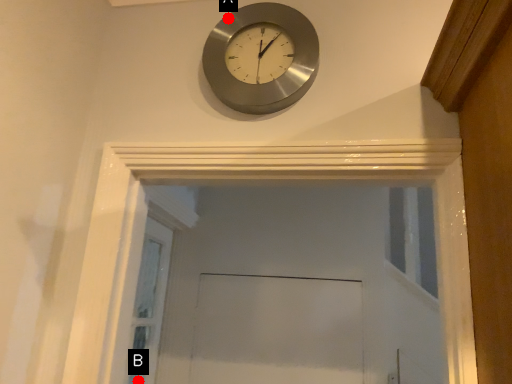
Question: Two points are circled on the image, labeled by A and B beside each circle. Which point is closer to the camera taking this photo?

Choices:
 (A) A is closer
 (B) B is closer

Answer: (A)